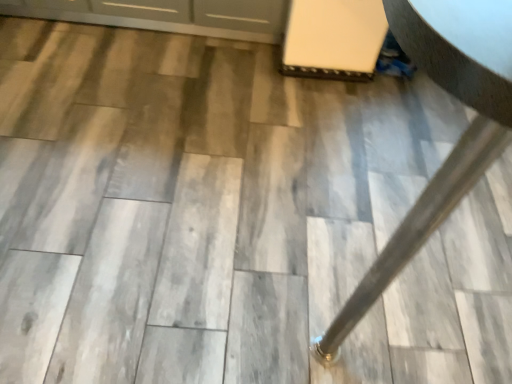
Locate an element on the screen. Image resolution: width=512 pixels, height=384 pixels. metallic pole at lower right is located at coordinates (459, 139).

Measure the distance between metallic pole at lower right and camera.

A distance of 10.59 inches exists between metallic pole at lower right and camera.

Describe the element at coordinates (459, 139) in the screenshot. I see `metallic pole at lower right` at that location.

This screenshot has width=512, height=384. I want to click on metallic pole at lower right, so (x=459, y=139).